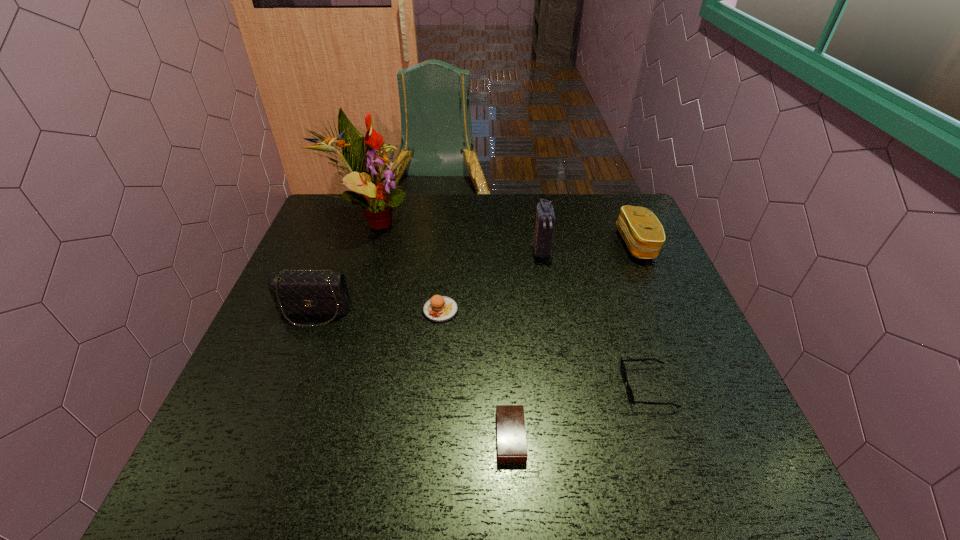
This screenshot has height=540, width=960. Identify the location of free area in between the tallest object and the fifth shortest object. (342, 266).

Identify the location of vacant space that is in between the rightmost clutch bag and the patty. The image size is (960, 540). (539, 277).

The height and width of the screenshot is (540, 960). I want to click on free space that is in between the nearest object and the tallest object, so click(x=441, y=328).

I want to click on blank region between the fourth object from right to left and the second clutch bag from right to left, so click(526, 343).

Where is `free point between the rightmost clutch bag and the tallest object`? The height and width of the screenshot is (540, 960). free point between the rightmost clutch bag and the tallest object is located at coordinates (503, 232).

Image resolution: width=960 pixels, height=540 pixels. What are the coordinates of `free space between the nearest object and the bouquet` in the screenshot? It's located at pos(441,328).

Locate an element on the screen. The image size is (960, 540). vacant area between the tallest object and the third shortest object is located at coordinates (405, 265).

Locate an element on the screen. Image resolution: width=960 pixels, height=540 pixels. vacant area that lies between the sixth shortest object and the fourth object from right to left is located at coordinates (526, 343).

Identify the location of vacant space that's between the rightmost clutch bag and the bouquet. (503, 232).

Find the location of a particular element. free point between the second object from right to left and the tallest object is located at coordinates (509, 303).